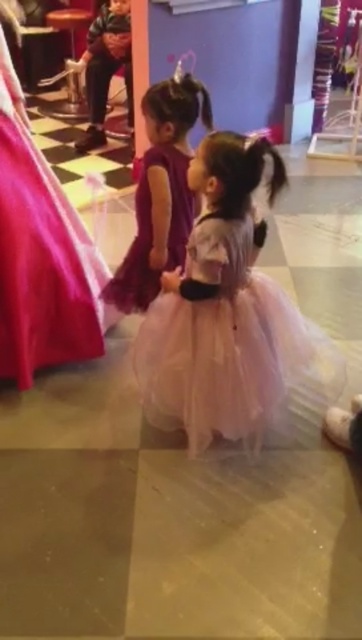
You are a photographer at a princess photoshoot. You need to position two children wearing purple tulle dresses. The child in the purple tulle dress at left is currently standing lower than the child in the purple tulle dress at center. To make them stand at the same height for a group photo, which child should you move upwards?

You should move the purple tulle dress at left upwards to match the height of the purple tulle dress at center since the purple tulle dress at left is currently located below the other.

In the scene shown: You are a photographer at a princess event. You need to capture a photo of both children wearing purple tulle dresses. However, the child in the purple tulle dress at left is blocking the view of the other child in the purple tulle dress at center. Can you adjust your position to include both in the frame without moving them?

The purple tulle dress at left is in front of the purple tulle dress at center. To include both in the frame, move to a position where you can see around or behind the child in the purple tulle dress at left to capture both children.

Based on the photo, you are a photographer setting up for a group photo. You need to position the pink tulle dress at center and the purple tulle dress at left so that both can fit comfortably in the frame. Considering their dress widths, which child should stand closer to the center to avoid overlapping?

The pink tulle dress at center has a larger width than the purple tulle dress at left, so the child in the pink tulle dress at center should stand closer to the center to accommodate its wider silhouette without overlapping.